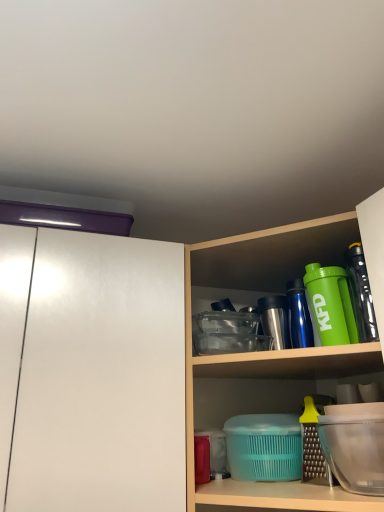
Question: Considering the relative positions of white glossy cabinet at left and green matte shaker at upper right, the 1th bottle viewed from the front, in the image provided, is white glossy cabinet at left to the left or to the right of green matte shaker at upper right, the 1th bottle viewed from the front,?

Choices:
 (A) right
 (B) left

Answer: (B)

Question: In terms of width, does white glossy cabinet at left look wider or thinner when compared to green matte shaker at upper right, the 2th bottle when ordered from back to front?

Choices:
 (A) wide
 (B) thin

Answer: (A)

Question: Based on their relative distances, which object is farther from the green matte shaker at upper right, the 2th bottle when ordered from front to back?

Choices:
 (A) transparent plastic container at lower right
 (B) translucent plastic containers at center
 (C) green matte shaker at upper right, the 2th bottle when ordered from back to front
 (D) white glossy cabinet at left

Answer: (D)

Question: Considering the real-world distances, which object is farthest from the white glossy cabinet at left?

Choices:
 (A) green matte shaker at upper right, the 2th bottle when ordered from back to front
 (B) green matte shaker at upper right, which appears as the first bottle when viewed from the back
 (C) translucent plastic containers at center
 (D) transparent plastic container at lower right

Answer: (D)